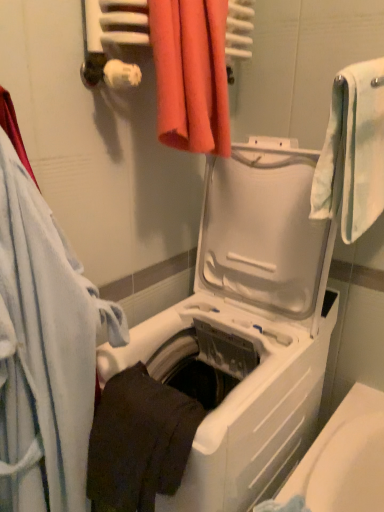
Question: Is dark matte towel at lower center, which is counted as the third towel, starting from the right, thinner than orange fabric towel at upper center, the third towel in the left-to-right sequence?

Choices:
 (A) yes
 (B) no

Answer: (B)

Question: Considering the relative positions of dark matte towel at lower center, arranged as the second towel when viewed from the left, and orange fabric towel at upper center, the 2th towel when ordered from right to left, in the image provided, is dark matte towel at lower center, arranged as the second towel when viewed from the left, to the right of orange fabric towel at upper center, the 2th towel when ordered from right to left, from the viewer's perspective?

Choices:
 (A) no
 (B) yes

Answer: (A)

Question: Could you tell me if dark matte towel at lower center, which is counted as the third towel, starting from the right, is turned towards orange fabric towel at upper center, the third towel in the left-to-right sequence?

Choices:
 (A) no
 (B) yes

Answer: (A)

Question: Does dark matte towel at lower center, which is counted as the third towel, starting from the right, have a greater height compared to orange fabric towel at upper center, the 2th towel when ordered from right to left?

Choices:
 (A) no
 (B) yes

Answer: (A)

Question: Is dark matte towel at lower center, which is counted as the third towel, starting from the right, touching orange fabric towel at upper center, the 2th towel when ordered from right to left?

Choices:
 (A) no
 (B) yes

Answer: (A)

Question: Is dark matte towel at lower center, which is counted as the third towel, starting from the right, inside or outside of orange fabric towel at upper center, the third towel in the left-to-right sequence?

Choices:
 (A) outside
 (B) inside

Answer: (A)

Question: Is dark matte towel at lower center, which is counted as the third towel, starting from the right, bigger or smaller than orange fabric towel at upper center, the 2th towel when ordered from right to left?

Choices:
 (A) big
 (B) small

Answer: (A)

Question: Considering their positions, is dark matte towel at lower center, which is counted as the third towel, starting from the right, located in front of or behind orange fabric towel at upper center, the 2th towel when ordered from right to left?

Choices:
 (A) behind
 (B) front

Answer: (B)

Question: Considering the relative positions of dark matte towel at lower center, which is counted as the third towel, starting from the right, and orange fabric towel at upper center, the 2th towel when ordered from right to left, in the image provided, is dark matte towel at lower center, which is counted as the third towel, starting from the right, to the left or to the right of orange fabric towel at upper center, the 2th towel when ordered from right to left,?

Choices:
 (A) left
 (B) right

Answer: (A)

Question: From a real-world perspective, relative to dark matte towel at lower center, arranged as the second towel when viewed from the left, is white plastic washing machine at center vertically above or below?

Choices:
 (A) above
 (B) below

Answer: (B)

Question: Is point (284, 432) closer or farther from the camera than point (139, 410)?

Choices:
 (A) farther
 (B) closer

Answer: (A)

Question: Considering the positions of white plastic washing machine at center and dark matte towel at lower center, which is counted as the third towel, starting from the right, in the image, is white plastic washing machine at center taller or shorter than dark matte towel at lower center, which is counted as the third towel, starting from the right,?

Choices:
 (A) tall
 (B) short

Answer: (A)

Question: In the image, is white plastic washing machine at center on the left side or the right side of dark matte towel at lower center, which is counted as the third towel, starting from the right?

Choices:
 (A) left
 (B) right

Answer: (B)

Question: From the image's perspective, is dark matte towel at lower center, arranged as the second towel when viewed from the left, above or below white soft towel at right, which is the fourth towel from left to right?

Choices:
 (A) above
 (B) below

Answer: (B)

Question: Considering the positions of dark matte towel at lower center, arranged as the second towel when viewed from the left, and white soft towel at right, the first towel positioned from the right, in the image, is dark matte towel at lower center, arranged as the second towel when viewed from the left, taller or shorter than white soft towel at right, the first towel positioned from the right,?

Choices:
 (A) short
 (B) tall

Answer: (A)